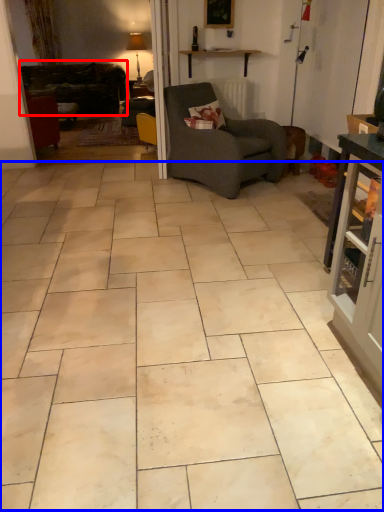
Question: Among these objects, which one is farthest to the camera, studio couch (highlighted by a red box) or ceramic tile (highlighted by a blue box)?

Choices:
 (A) studio couch
 (B) ceramic tile

Answer: (A)